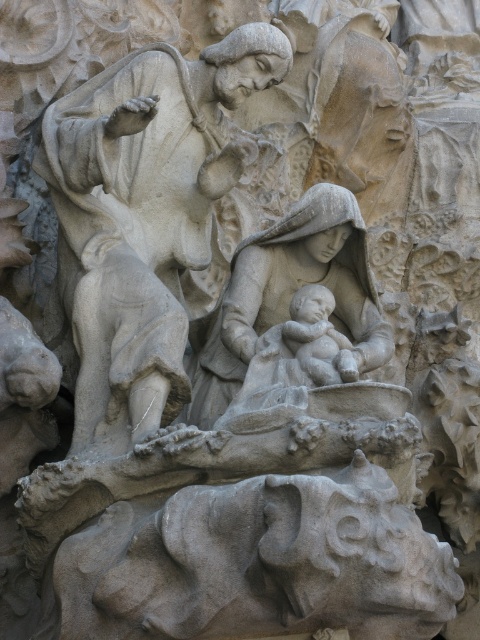
Question: Can you confirm if stone statue at upper center is smaller than gray stone statue of mother holding baby at center?

Choices:
 (A) yes
 (B) no

Answer: (B)

Question: Can you confirm if stone statue at upper center is positioned above gray stone statue of mother holding baby at center?

Choices:
 (A) no
 (B) yes

Answer: (B)

Question: Among these points, which one is nearest to the camera?

Choices:
 (A) (134, 432)
 (B) (233, 36)

Answer: (A)

Question: Which object appears farthest from the camera in this image?

Choices:
 (A) stone statue at upper center
 (B) matte stone baby at center
 (C) gray stone statue of mother holding baby at center

Answer: (B)

Question: Considering the relative positions of stone statue at upper center and matte stone baby at center in the image provided, where is stone statue at upper center located with respect to matte stone baby at center?

Choices:
 (A) above
 (B) below

Answer: (A)

Question: Which of the following is the farthest from the observer?

Choices:
 (A) (135, 435)
 (B) (66, 221)
 (C) (287, 237)

Answer: (C)